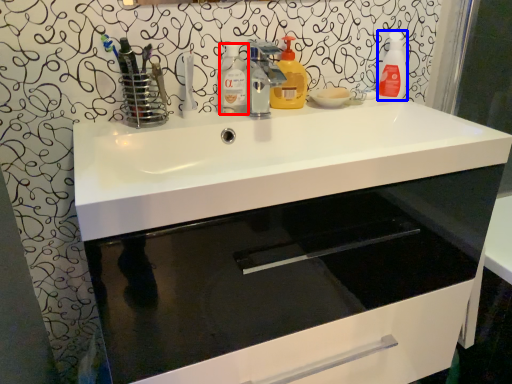
Question: Which of the following is the closest to the observer, cleaning product (highlighted by a red box) or cleaning product (highlighted by a blue box)?

Choices:
 (A) cleaning product
 (B) cleaning product

Answer: (A)